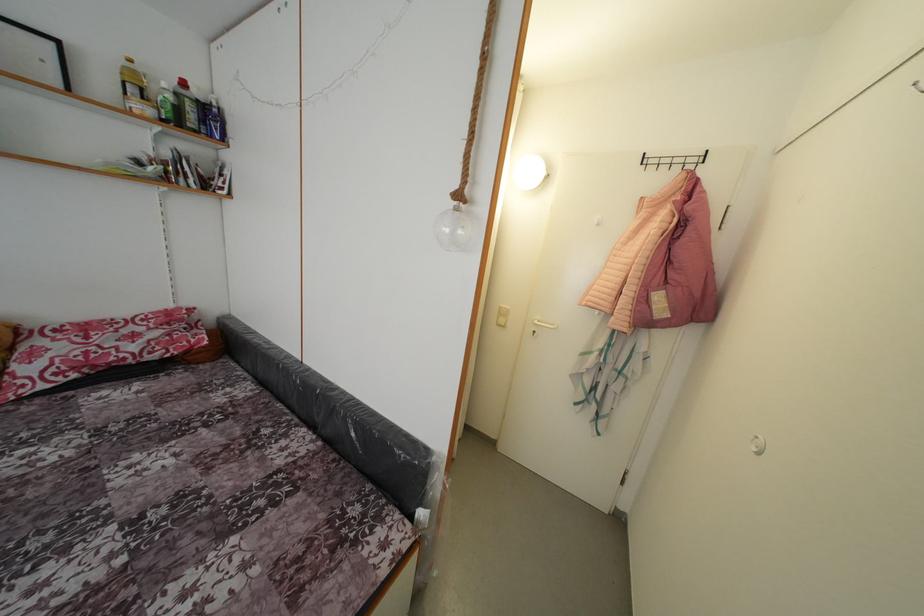
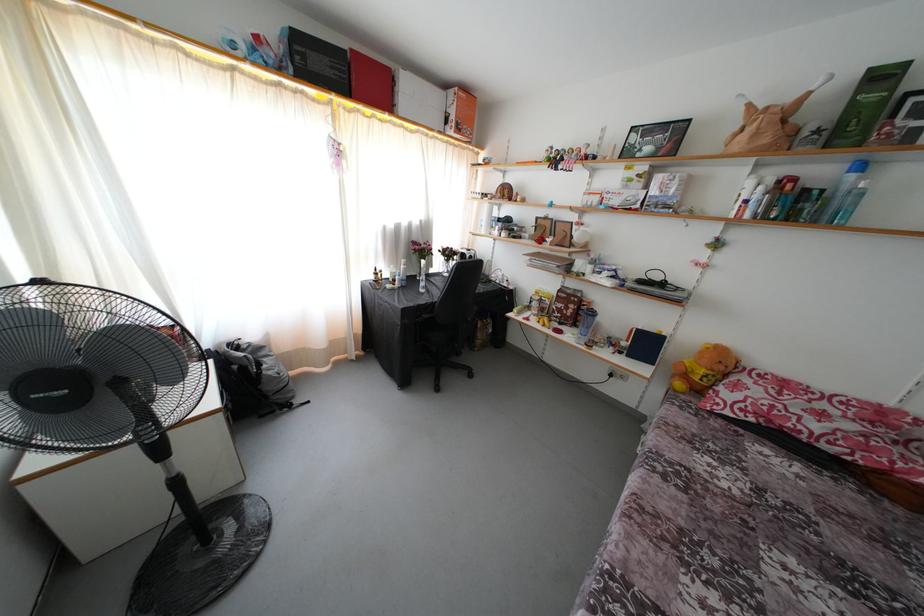
Find the pixel in the second image that matches the point at 61,346 in the first image.

(760, 389)